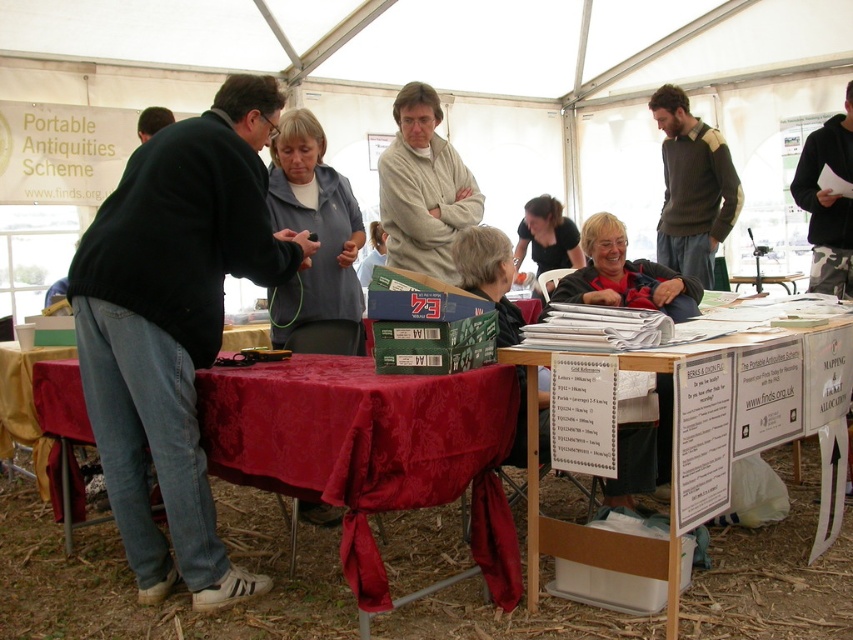
Question: Does light beige sweater at center appear under gray fleece jacket at center?

Choices:
 (A) yes
 (B) no

Answer: (B)

Question: Which object appears farthest from the camera in this image?

Choices:
 (A) matte black jacket at center
 (B) matte green fabric at center
 (C) white cardboard table at center
 (D) light beige sweater at center

Answer: (D)

Question: Is red satin tablecloth at lower left positioned at the back of gray fleece jacket at center?

Choices:
 (A) yes
 (B) no

Answer: (B)

Question: Can you confirm if red satin tablecloth at lower left is bigger than white cardboard table at center?

Choices:
 (A) no
 (B) yes

Answer: (A)

Question: Estimate the real-world distances between objects in this image. Which object is farther from the matte black jacket at center?

Choices:
 (A) red satin tablecloth at lower left
 (B) gray fleece jacket at center
 (C) dark brown sweater at upper right
 (D) black matte jacket at left

Answer: (C)

Question: Which of the following is the farthest from the observer?

Choices:
 (A) (218, 413)
 (B) (326, 211)
 (C) (485, 228)

Answer: (B)